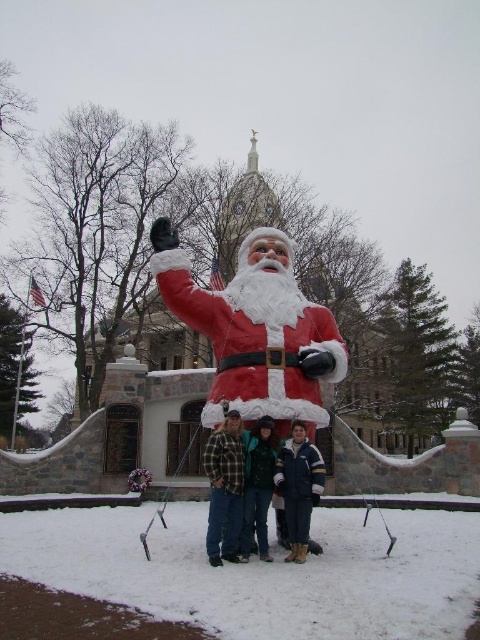
You are trying to locate the matte plastic santa at center in the winter scene. According to the coordinates provided, where exactly is the matte plastic santa positioned?

The matte plastic santa at center is located at point coordinates of (254, 330).

You are a photographer trying to capture a group photo of the flannel shirt at center and the matte red santa at center. Based on their sizes, which one should you focus on first to ensure they both fit in the frame?

The matte red santa at center is bigger than the flannel shirt at center, so you should focus on the matte red santa at center first to ensure it fits in the frame, and then adjust to include the flannel shirt at center.

You are planning to take a photo of the matte plastic santa at center with the white fluffy snow at lower center as the foreground. Since the snow is lower than the Santa, how should you position the camera to ensure both are in focus?

The white fluffy snow at lower center has a lesser height compared to matte plastic santa at center, so you should position the camera at a lower angle to capture both the matte plastic santa at center and the white fluffy snow at lower center in focus.